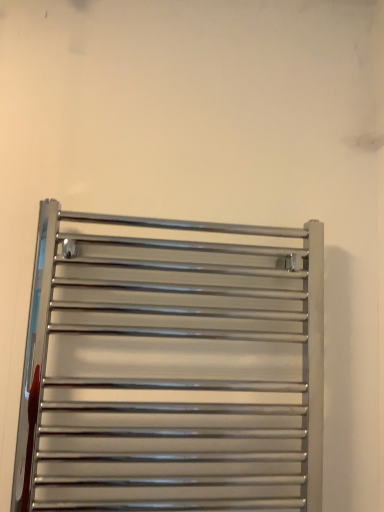
Consider the image. What is the approximate height of polished chrome towel rack at center?

polished chrome towel rack at center is 25.39 inches in height.

Find the location of a particular element. The width and height of the screenshot is (384, 512). polished chrome towel rack at center is located at coordinates (171, 369).

What do you see at coordinates (171, 369) in the screenshot? The height and width of the screenshot is (512, 384). I see `polished chrome towel rack at center` at bounding box center [171, 369].

At what (x,y) coordinates should I click in order to perform the action: click on polished chrome towel rack at center. Please return your answer as a coordinate pair (x, y). The height and width of the screenshot is (512, 384). Looking at the image, I should click on (171, 369).